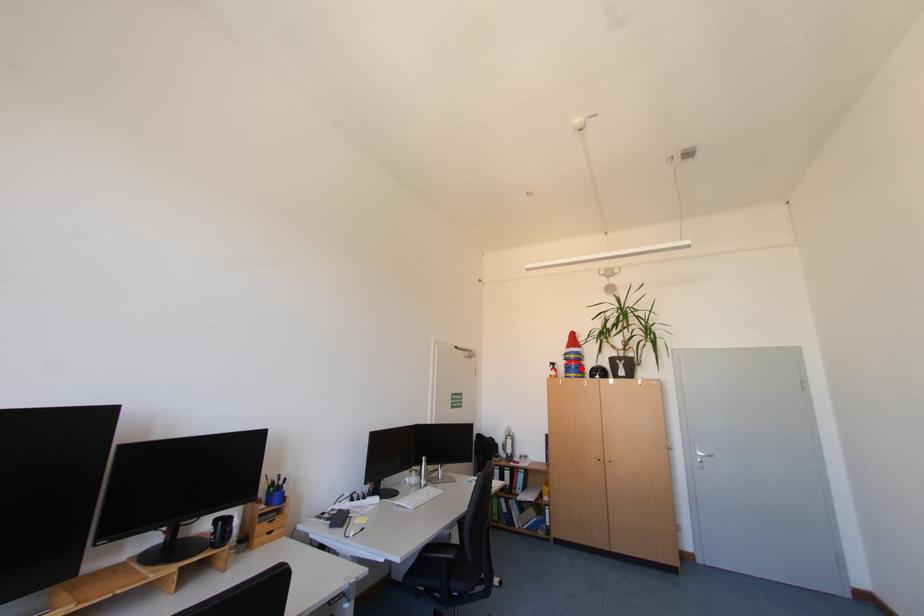
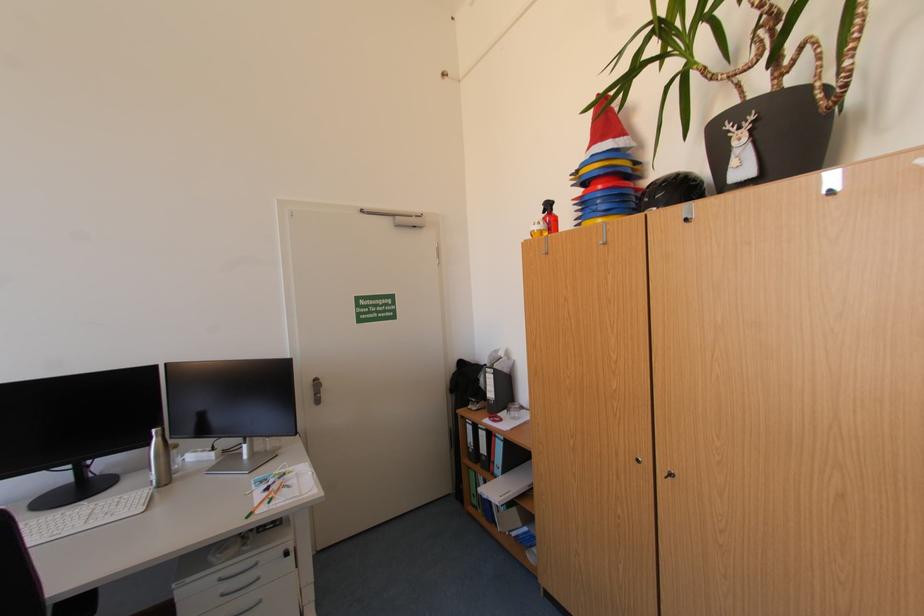
The point at the highlighted location is marked in the first image. Where is the corresponding point in the second image?

(606, 203)